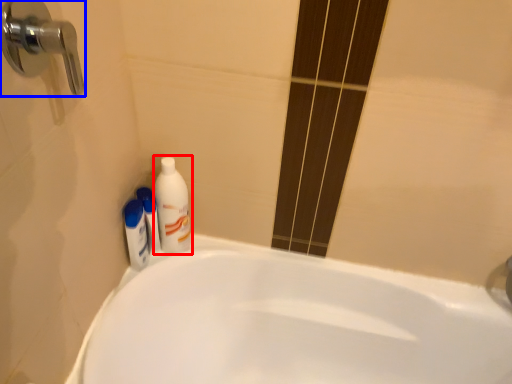
Question: Among these objects, which one is nearest to the camera, cleaning product (highlighted by a red box) or door handle (highlighted by a blue box)?

Choices:
 (A) cleaning product
 (B) door handle

Answer: (B)